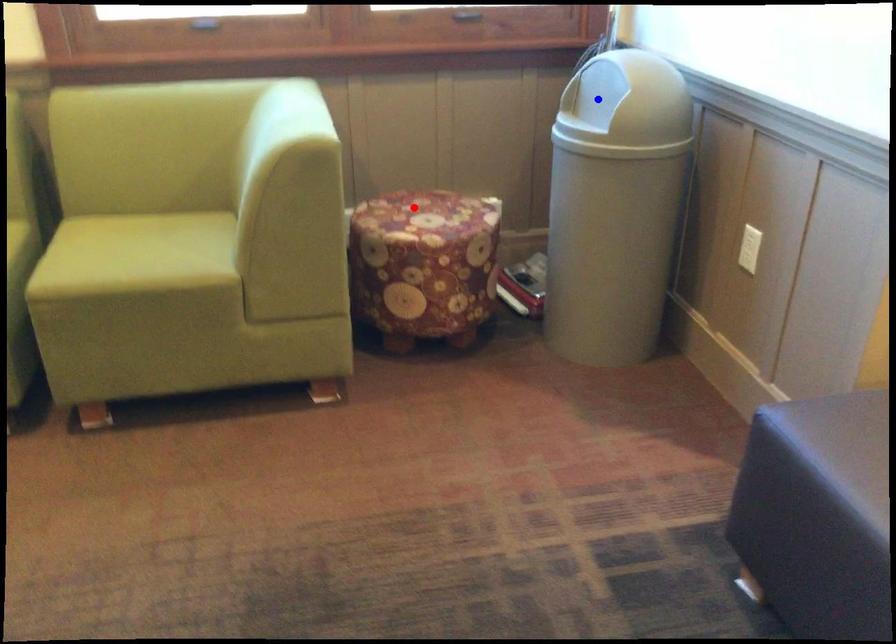
Question: Two points are marked on the image. Which point is closer to the camera?

Choices:
 (A) Blue point is closer.
 (B) Red point is closer.

Answer: (A)